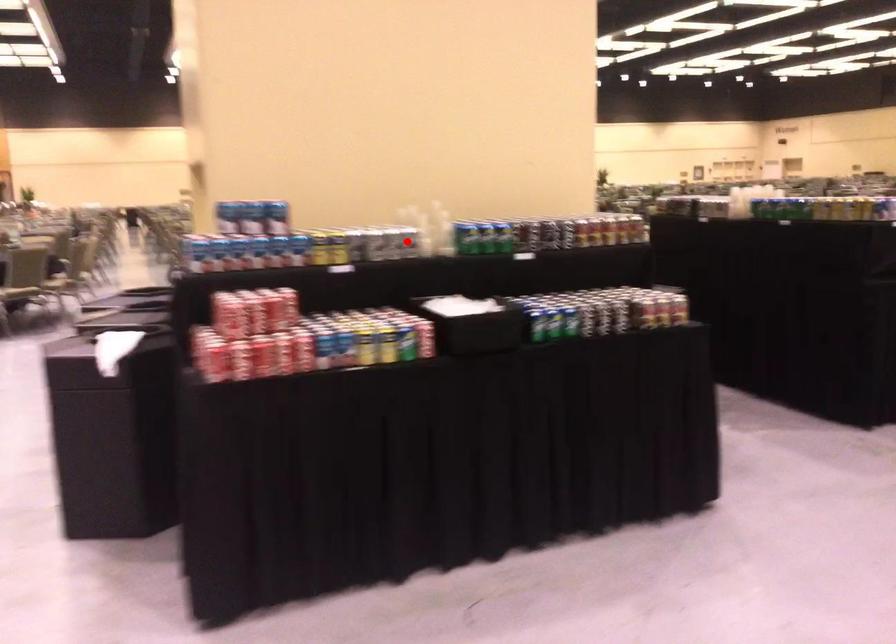
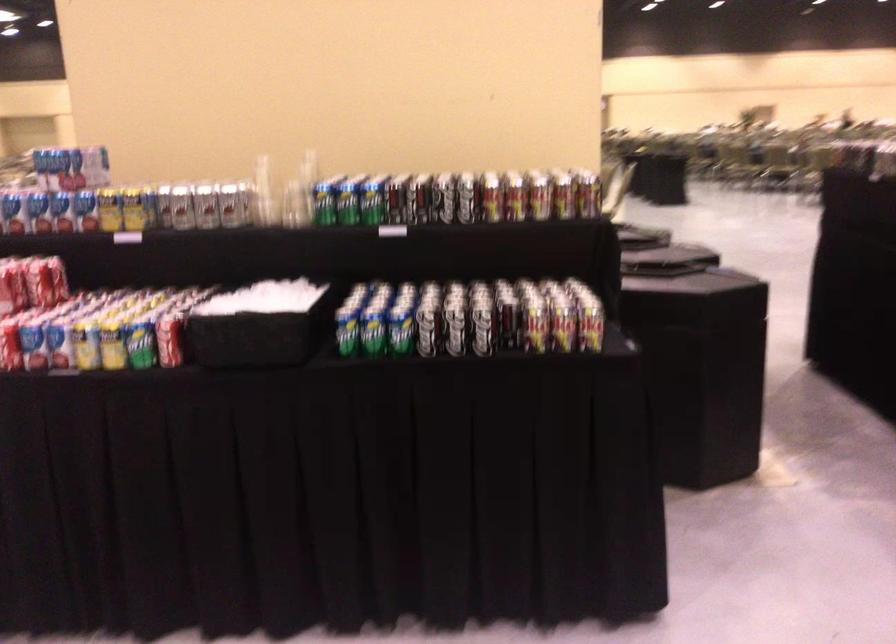
Question: I am providing you with two images of the same scene from different viewpoints. A red point is shown in image1. For the corresponding object point in image2, is it positioned nearer or farther from the camera?

Choices:
 (A) Nearer
 (B) Farther

Answer: (A)